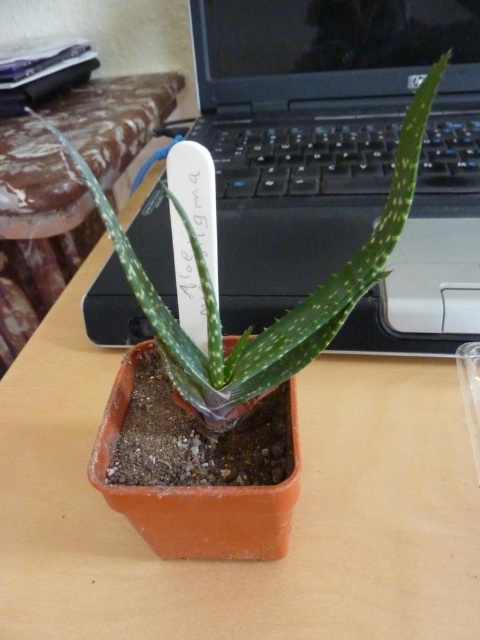
Question: Which object appears farthest from the camera in this image?

Choices:
 (A) black plastic laptop at upper center
 (B) green matte aloe vera at center

Answer: (A)

Question: Among these objects, which one is nearest to the camera?

Choices:
 (A) black plastic laptop at upper center
 (B) green matte aloe vera at center

Answer: (B)

Question: In this image, where is black plastic laptop at upper center located relative to green matte aloe vera at center?

Choices:
 (A) below
 (B) above

Answer: (B)

Question: Does black plastic laptop at upper center have a smaller size compared to green matte aloe vera at center?

Choices:
 (A) no
 (B) yes

Answer: (B)

Question: Does black plastic laptop at upper center appear on the left side of green matte aloe vera at center?

Choices:
 (A) yes
 (B) no

Answer: (A)